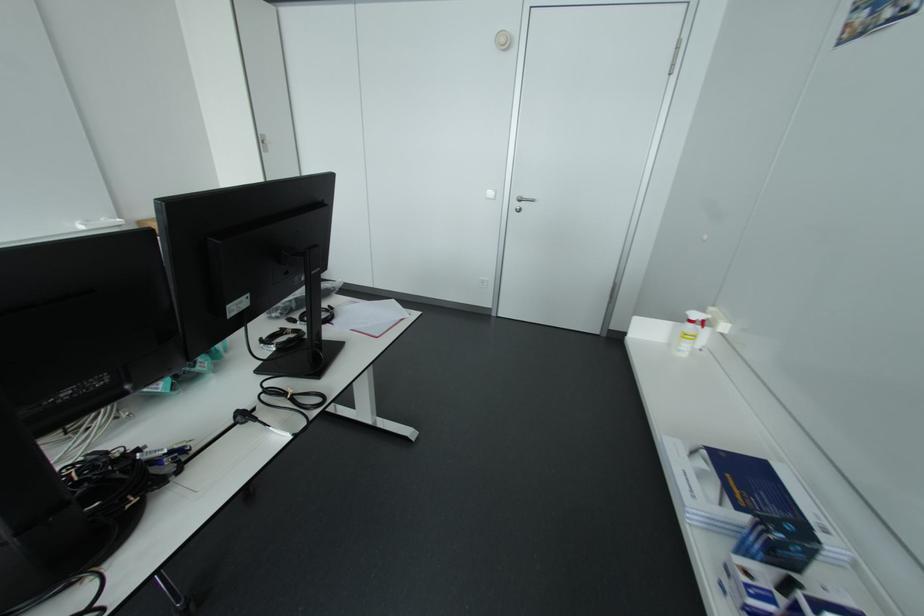
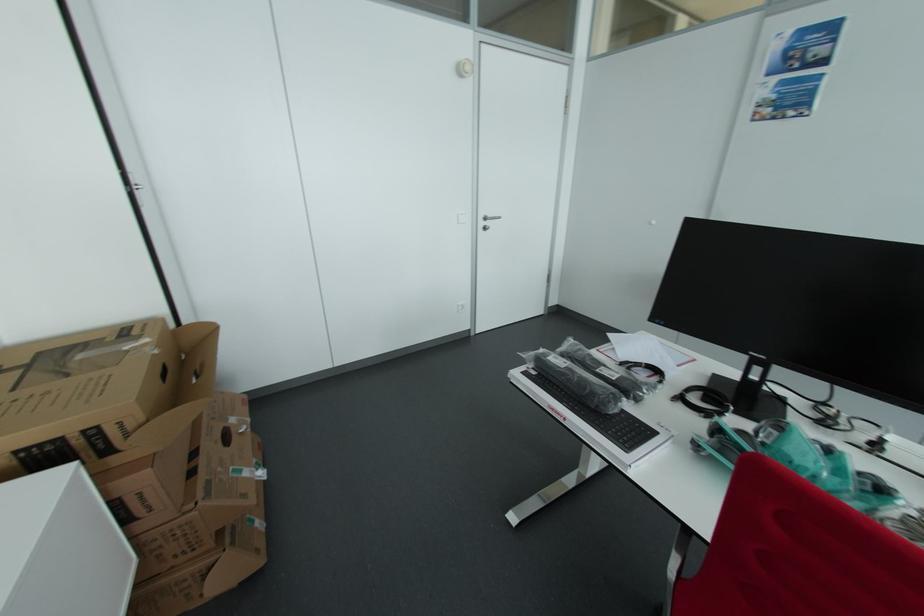
The point at (x=528, y=198) is marked in the first image. Where is the corresponding point in the second image?

(493, 216)